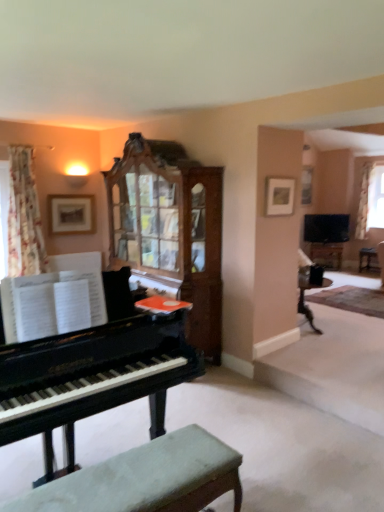
Question: Visually, is wooden side table at right positioned to the left or to the right of white sheer curtain at upper right, which is the second curtain from front to back?

Choices:
 (A) right
 (B) left

Answer: (A)

Question: From the image's perspective, is wooden side table at right above or below white sheer curtain at upper right, which is the second curtain from front to back?

Choices:
 (A) above
 (B) below

Answer: (B)

Question: Based on their relative distances, which object is farther from the matte black table at right?

Choices:
 (A) green fabric bench at lower center
 (B) wooden picture frame at upper left, arranged as the second picture frame when viewed from the front
 (C) floral fabric curtain at upper left, which is counted as the 2th curtain, starting from the back
 (D) black polished piano at left
 (E) matte wooden picture frame at upper center, placed as the 2th picture frame when sorted from back to front

Answer: (A)

Question: Which object is the closest to the flat-screen tv at upper right?

Choices:
 (A) green fabric bench at lower center
 (B) wooden picture frame at upper left, marked as the 1th picture frame in a back-to-front arrangement
 (C) wooden side table at right
 (D) matte wooden picture frame at upper center, acting as the 1th picture frame starting from the right
 (E) white sheer curtain at upper right, the second curtain in the left-to-right sequence

Answer: (E)